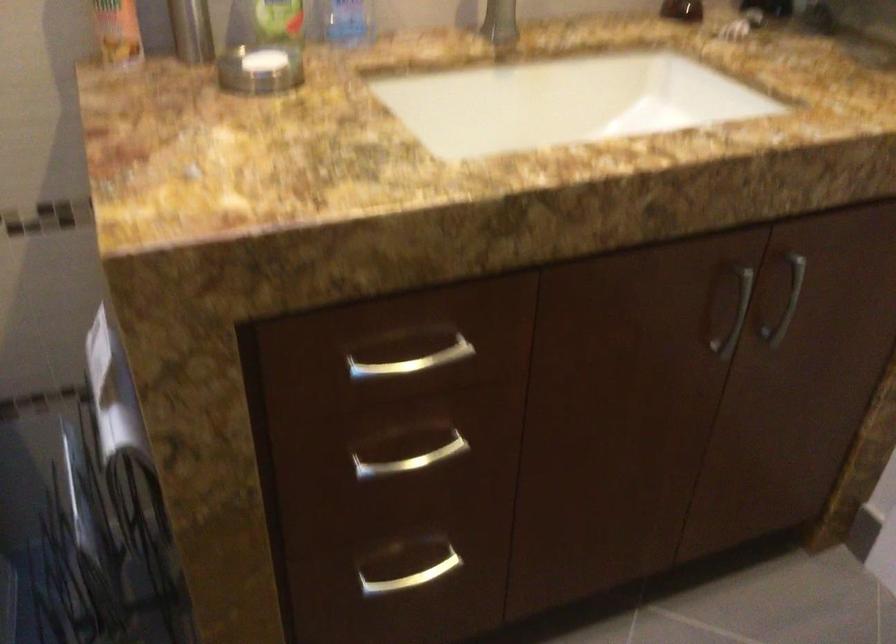
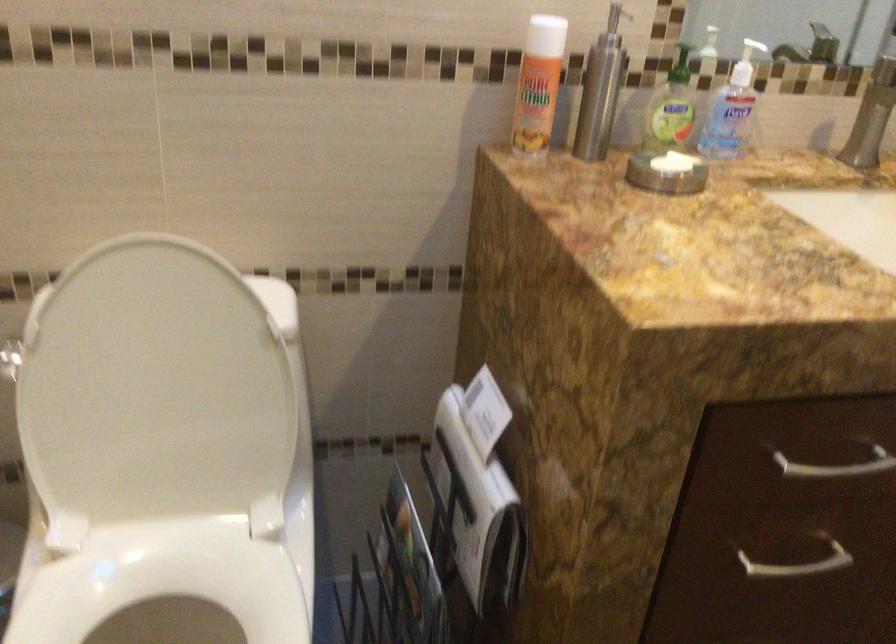
Question: I am providing you with two images of the same scene from different viewpoints. Please identify which objects are invisible in image2.

Choices:
 (A) white soap bar
 (B) white dispenser pump
 (C) silver drawer handle
 (D) none of these

Answer: (D)